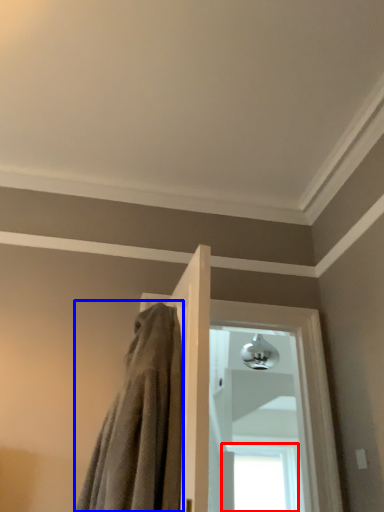
Question: Which object is further to the camera taking this photo, window (highlighted by a red box) or bath towel (highlighted by a blue box)?

Choices:
 (A) window
 (B) bath towel

Answer: (A)